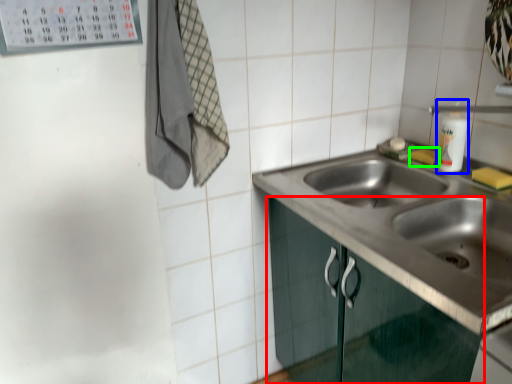
Question: Based on their relative distances, which object is nearer to cabinetry (highlighted by a red box)? Choose from bottle (highlighted by a blue box) and soap (highlighted by a green box).

Choices:
 (A) bottle
 (B) soap

Answer: (A)